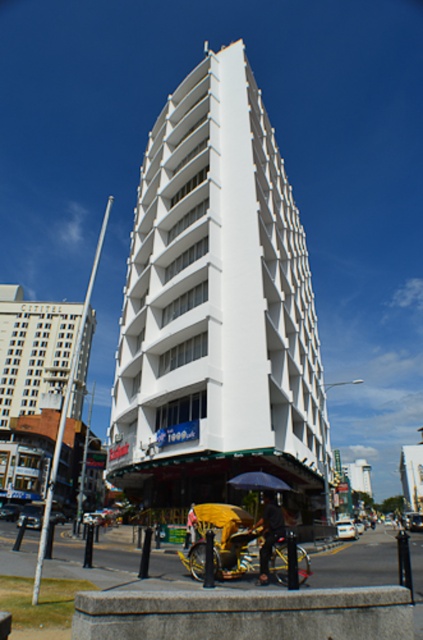
Question: From the image, what is the correct spatial relationship of white smooth building at center in relation to yellow fabric at center?

Choices:
 (A) right
 (B) left

Answer: (A)

Question: Among these points, which one is nearest to the camera?

Choices:
 (A) (194, 332)
 (B) (275, 522)

Answer: (B)

Question: Which of the following is the farthest from the observer?

Choices:
 (A) (134, 291)
 (B) (186, 531)
 (C) (266, 508)

Answer: (A)

Question: Is yellow fabric rickshaw at lower center to the left of dark gray fabric umbrella at center from the viewer's perspective?

Choices:
 (A) yes
 (B) no

Answer: (A)

Question: Is the position of dark gray fabric umbrella at center less distant than that of yellow fabric at center?

Choices:
 (A) yes
 (B) no

Answer: (A)

Question: Among these points, which one is nearest to the camera?

Choices:
 (A) (282, 516)
 (B) (202, 532)

Answer: (A)